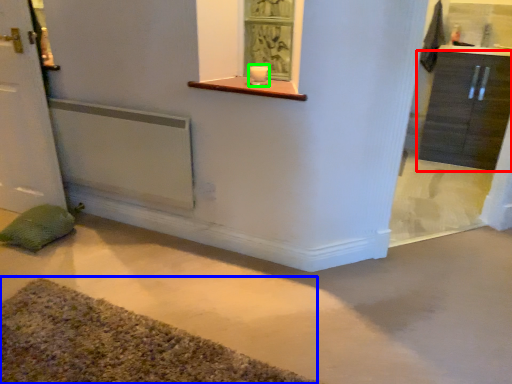
Question: Which object is positioned farthest from cabinetry (highlighted by a red box)? Select from bath mat (highlighted by a blue box) and candle holder (highlighted by a green box).

Choices:
 (A) bath mat
 (B) candle holder

Answer: (A)